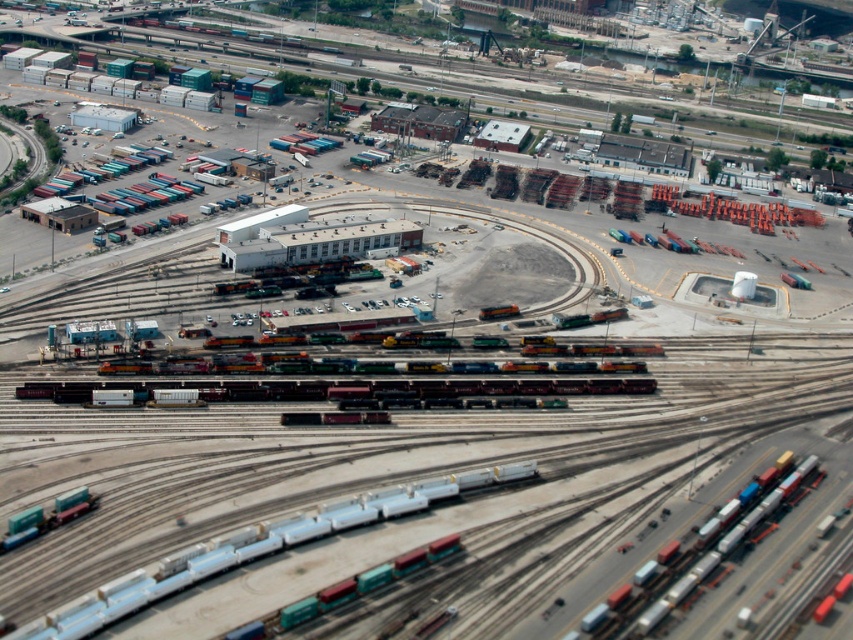
You are a train conductor who needs to guide a new train into the rail yard. You see the metallic silver train at lower right and the shiny metallic train at center. Which train is positioned further to the east?

The metallic silver train at lower right is positioned further to the east because it is to the right of the shiny metallic train at center, and in an aerial view, right typically corresponds to east.

You are a train conductor standing at the center of the rail yard. You need to locate the metallic blue train car at bottom left. According to the coordinates provided, where should you look relative to your position?

The metallic blue train car at bottom left is located at point 0.859 on the x axis and 0.300 on the y axis. Since the coordinates are relative to the image, the conductor should look towards the bottom left direction from their central position to find it.

You are a maintenance worker needing to inspect the space between the metallic silver train at lower right and the shiny metallic train at center. Can you safely walk through the gap if you require a minimum of 1.5 meters of clearance?

The distance between the metallic silver train at lower right and the shiny metallic train at center is 17.12 meters, which is significantly more than the required 1.5 meters. Therefore, you can safely walk through the gap.